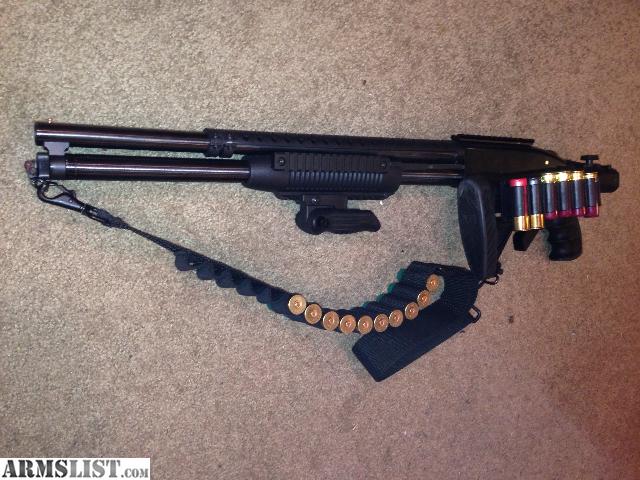
Where is `carpeted floor`? This screenshot has height=480, width=640. carpeted floor is located at coordinates (329, 267).